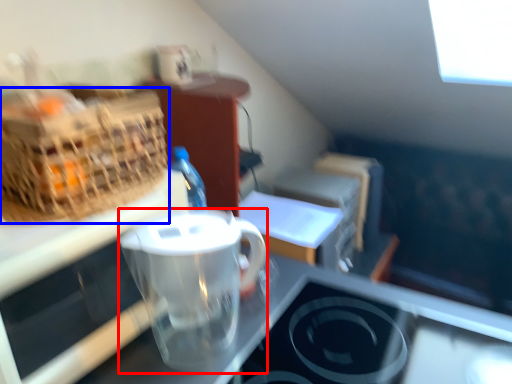
Question: Among these objects, which one is farthest to the camera, coffee cup (highlighted by a red box) or picnic basket (highlighted by a blue box)?

Choices:
 (A) coffee cup
 (B) picnic basket

Answer: (A)